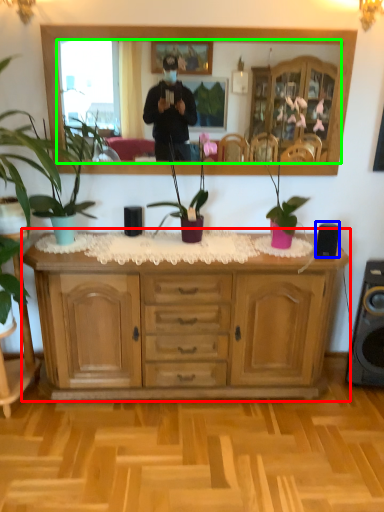
Question: Considering the real-world distances, which object is farthest from cabinetry (highlighted by a red box)? speaker (highlighted by a blue box) or mirror (highlighted by a green box)?

Choices:
 (A) speaker
 (B) mirror

Answer: (B)